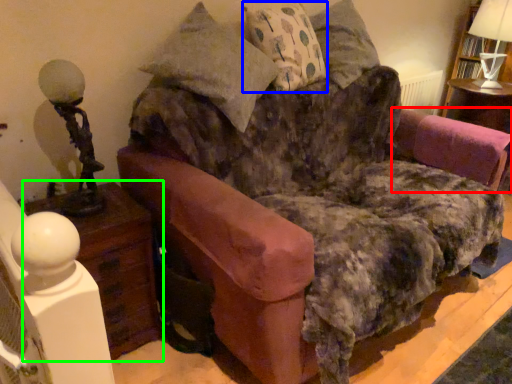
Question: Which is nearer to the swivel chair (highlighted by a red box)? pillow (highlighted by a blue box) or nightstand (highlighted by a green box).

Choices:
 (A) pillow
 (B) nightstand

Answer: (A)